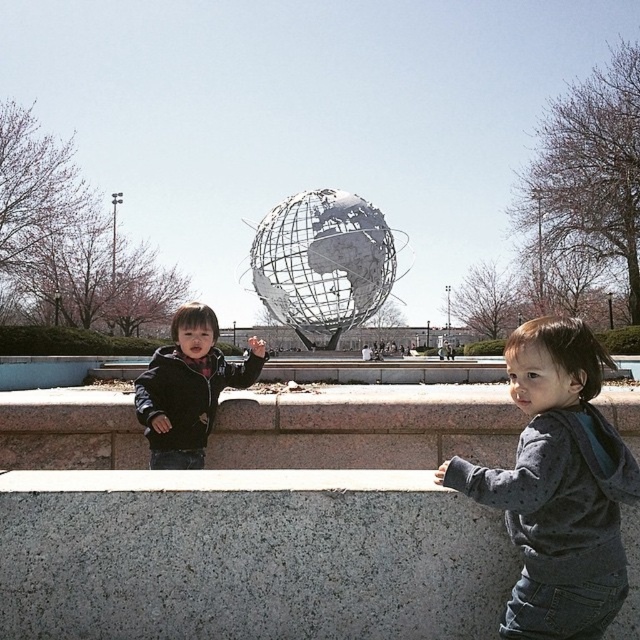
Which is in front, point (540, 477) or point (177, 435)?

Positioned in front is point (540, 477).

Is point (600, 566) less distant than point (188, 387)?

That is True.

Find the location of a particular element. The width and height of the screenshot is (640, 640). gray speckled hoodie at lower right is located at coordinates (557, 486).

Is metallic globe at center positioned behind matte black jacket at center?

Yes.

Is point (337, 212) farther from camera compared to point (138, 384)?

That is True.

Which is behind, point (304, 332) or point (140, 374)?

Point (304, 332)

The image size is (640, 640). I want to click on metallic globe at center, so click(x=323, y=262).

Who is more distant from viewer, (x=515, y=529) or (x=340, y=316)?

The point (x=340, y=316) is more distant.

Does gray speckled hoodie at lower right have a lesser height compared to metallic globe at center?

Correct, gray speckled hoodie at lower right is not as tall as metallic globe at center.

Find the location of a particular element. The height and width of the screenshot is (640, 640). gray speckled hoodie at lower right is located at coordinates (557, 486).